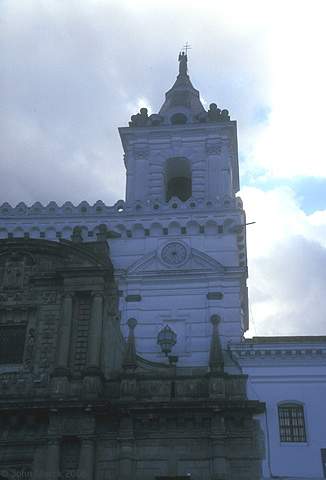
This screenshot has height=480, width=326. In order to click on clock in this screenshot , I will do `click(176, 245)`.